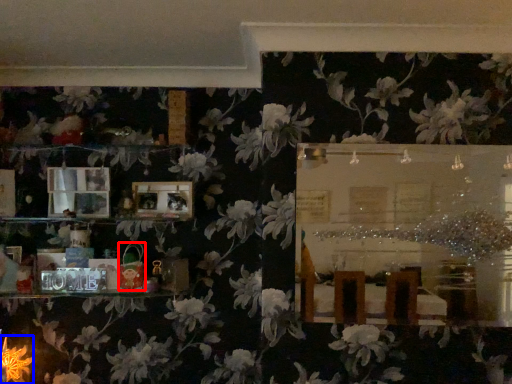
Question: Which point is further to the camera, toy (highlighted by a red box) or flower (highlighted by a blue box)?

Choices:
 (A) toy
 (B) flower

Answer: (B)